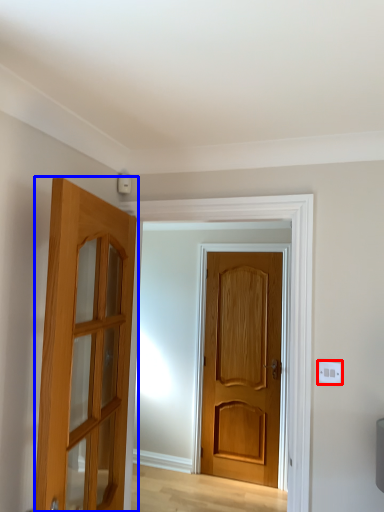
Question: Among these objects, which one is farthest to the camera, electric outlet (highlighted by a red box) or door (highlighted by a blue box)?

Choices:
 (A) electric outlet
 (B) door

Answer: (A)